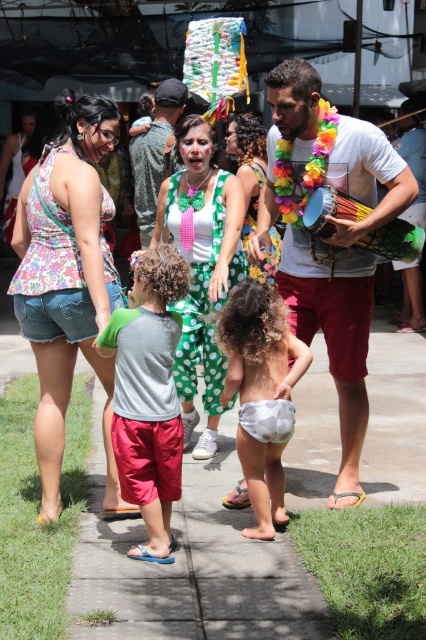
What are the coordinates of the gray cotton shirt at center in the image?

The coordinates of the gray cotton shirt at center are at point (149,396).